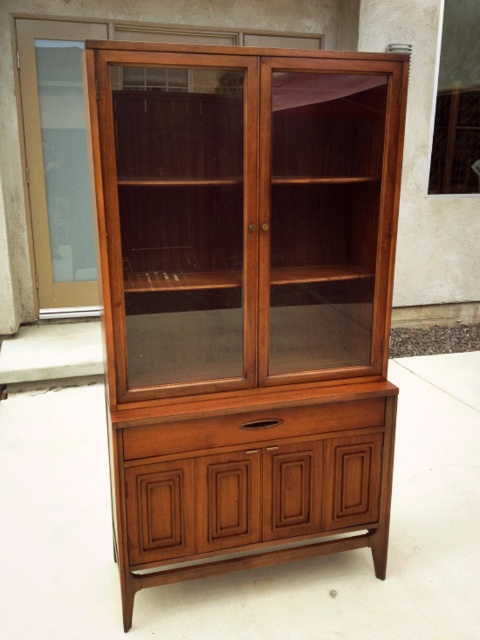
Does wooden drawer at center come in front of frosted glass door at left?

Yes, wooden drawer at center is closer to the viewer.

Which is in front, point (300, 493) or point (19, 67)?

Point (300, 493) is in front.

Image resolution: width=480 pixels, height=640 pixels. What are the coordinates of `wooden drawer at center` in the screenshot? It's located at (257, 480).

Which is in front, point (327, 65) or point (87, 200)?

Positioned in front is point (327, 65).

Is point (361, 60) farther from viewer compared to point (40, 189)?

No, (361, 60) is in front of (40, 189).

Which is in front, point (189, 320) or point (63, 20)?

Point (189, 320)

At what (x,y) coordinates should I click in order to perform the action: click on wooden cabinet at center. Please return your answer as a coordinate pair (x, y). Looking at the image, I should click on (244, 214).

Measure the distance between point (363, 205) and camera.

They are 2.30 meters apart.

Between point (304, 264) and point (271, 419), which one is positioned in front?

Point (271, 419)

The width and height of the screenshot is (480, 640). Identify the location of wooden cabinet at center. (244, 214).